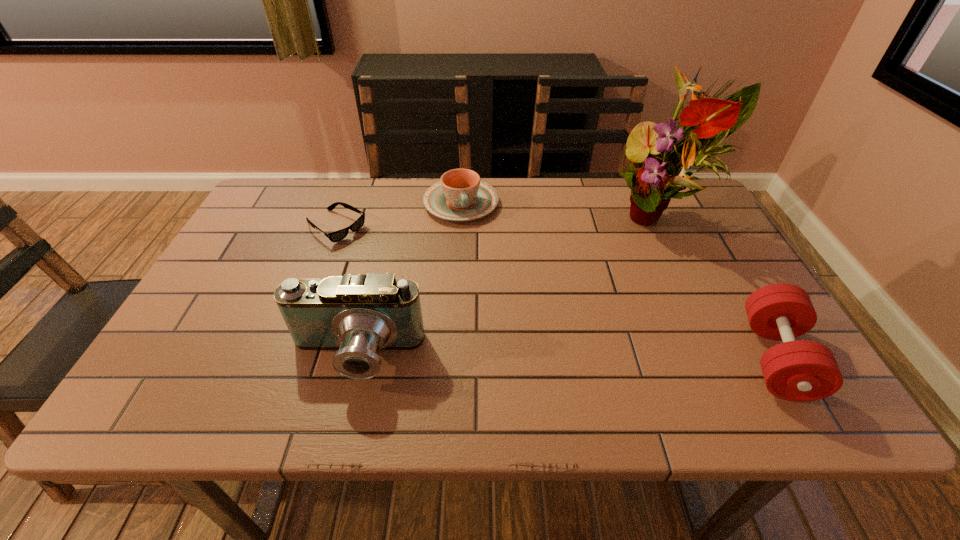
Image resolution: width=960 pixels, height=540 pixels. In order to click on dumbbell that is at the right edge in this screenshot , I will do `click(796, 370)`.

The height and width of the screenshot is (540, 960). Find the location of `bouquet that is at the right edge`. bouquet that is at the right edge is located at coordinates (654, 179).

This screenshot has width=960, height=540. Find the location of `object present at the far right corner`. object present at the far right corner is located at coordinates (654, 179).

At what (x,y) coordinates should I click in order to perform the action: click on object situated at the near right corner. Please return your answer as a coordinate pair (x, y). Image resolution: width=960 pixels, height=540 pixels. Looking at the image, I should click on (796, 370).

At what (x,y) coordinates should I click in order to perform the action: click on vacant space at the far edge. Please return your answer as a coordinate pair (x, y). The height and width of the screenshot is (540, 960). Looking at the image, I should click on 391,183.

I want to click on vacant region at the left edge, so click(x=239, y=287).

In the image, there is a desktop. At what (x,y) coordinates should I click in order to perform the action: click on vacant region at the right edge. Please return your answer as a coordinate pair (x, y). The height and width of the screenshot is (540, 960). Looking at the image, I should click on (713, 243).

This screenshot has height=540, width=960. In the image, there is a desktop. Identify the location of vacant space at the far left corner. (299, 190).

At what (x,y) coordinates should I click in order to perform the action: click on vacant space that is in between the third shortest object and the shortest object. Please return your answer as a coordinate pair (x, y). Looking at the image, I should click on (556, 293).

Where is `vacant space that's between the third shortest object and the chinaware`? Image resolution: width=960 pixels, height=540 pixels. vacant space that's between the third shortest object and the chinaware is located at coordinates (618, 281).